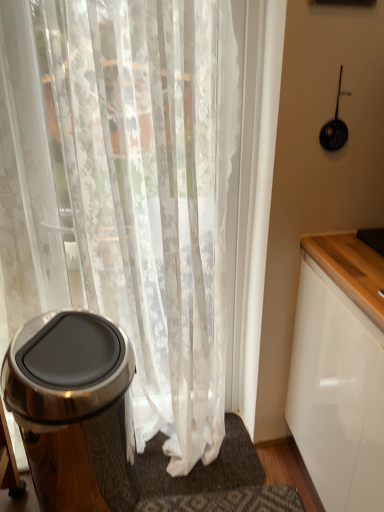
Question: Considering the relative sizes of white sheer curtain at left and polished stainless steel trash can at left in the image provided, is white sheer curtain at left smaller than polished stainless steel trash can at left?

Choices:
 (A) yes
 (B) no

Answer: (B)

Question: Considering the relative sizes of white sheer curtain at left and polished stainless steel trash can at left in the image provided, is white sheer curtain at left taller than polished stainless steel trash can at left?

Choices:
 (A) no
 (B) yes

Answer: (B)

Question: From the image's perspective, is white sheer curtain at left above polished stainless steel trash can at left?

Choices:
 (A) no
 (B) yes

Answer: (B)

Question: Is white sheer curtain at left to the left of polished stainless steel trash can at left from the viewer's perspective?

Choices:
 (A) yes
 (B) no

Answer: (B)

Question: Is white sheer curtain at left behind polished stainless steel trash can at left?

Choices:
 (A) yes
 (B) no

Answer: (B)

Question: Relative to white textured bath mat at lower center, is polished stainless steel trash can at left in front or behind?

Choices:
 (A) behind
 (B) front

Answer: (B)

Question: From the image's perspective, relative to white textured bath mat at lower center, is polished stainless steel trash can at left above or below?

Choices:
 (A) above
 (B) below

Answer: (A)

Question: From a real-world perspective, is polished stainless steel trash can at left physically located above or below white textured bath mat at lower center?

Choices:
 (A) below
 (B) above

Answer: (B)

Question: Is polished stainless steel trash can at left taller or shorter than white textured bath mat at lower center?

Choices:
 (A) short
 (B) tall

Answer: (B)

Question: In the image, is white sheer curtain at left positioned in front of or behind polished stainless steel trash can at left?

Choices:
 (A) front
 (B) behind

Answer: (A)

Question: From the image's perspective, is white sheer curtain at left above or below polished stainless steel trash can at left?

Choices:
 (A) above
 (B) below

Answer: (A)

Question: In the image, is white sheer curtain at left on the left side or the right side of polished stainless steel trash can at left?

Choices:
 (A) left
 (B) right

Answer: (B)

Question: In terms of width, does white sheer curtain at left look wider or thinner when compared to polished stainless steel trash can at left?

Choices:
 (A) wide
 (B) thin

Answer: (B)

Question: Relative to white sheer curtain at left, is white textured bath mat at lower center in front or behind?

Choices:
 (A) behind
 (B) front

Answer: (A)

Question: Is white textured bath mat at lower center bigger or smaller than white sheer curtain at left?

Choices:
 (A) big
 (B) small

Answer: (B)